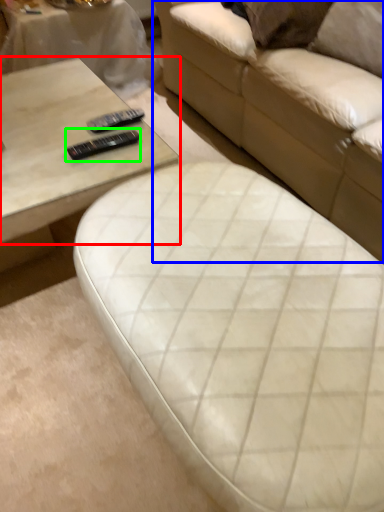
Question: Which is nearer to the coffee table (highlighted by a red box)? studio couch (highlighted by a blue box) or remote (highlighted by a green box).

Choices:
 (A) studio couch
 (B) remote

Answer: (B)